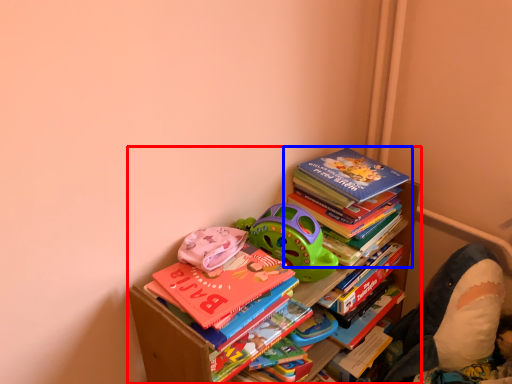
Question: Which object appears closest to the camera in this image, bookcase (highlighted by a red box) or book (highlighted by a blue box)?

Choices:
 (A) bookcase
 (B) book

Answer: (A)